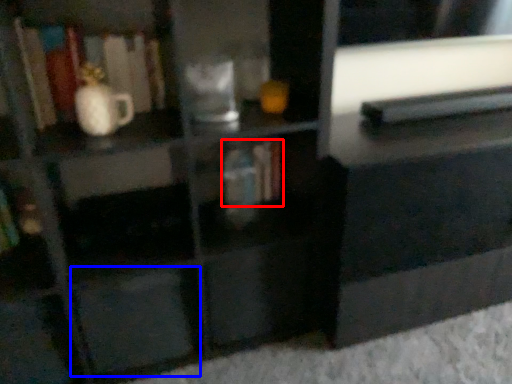
Question: Among these objects, which one is farthest to the camera, book (highlighted by a red box) or drawer (highlighted by a blue box)?

Choices:
 (A) book
 (B) drawer

Answer: (A)